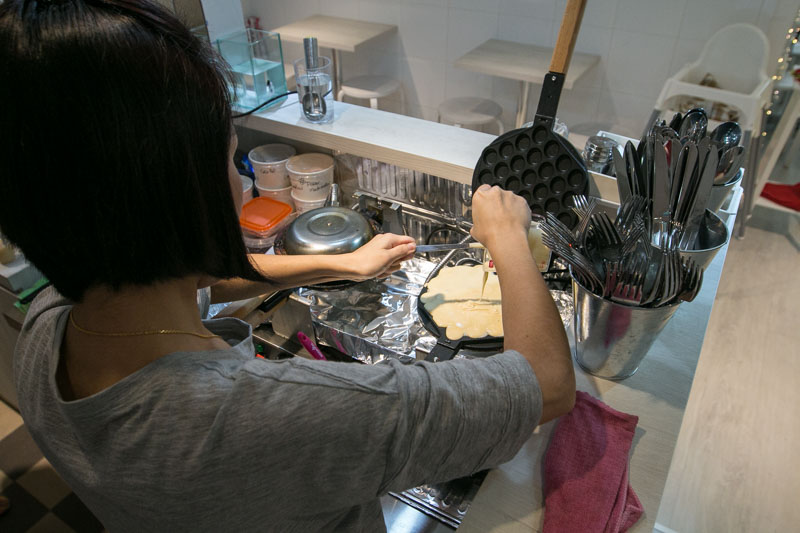
Where is `mug`? The image size is (800, 533). mug is located at coordinates (305, 177), (300, 205), (260, 169), (282, 198).